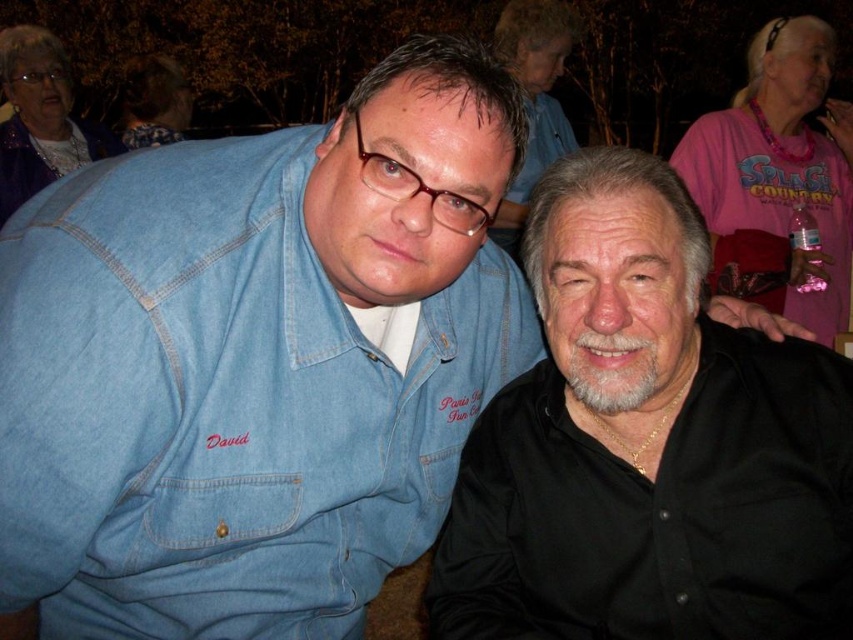
Based on the photo, how distant is matte purple jacket at upper left from matte pink shirt at upper center?

The distance of matte purple jacket at upper left from matte pink shirt at upper center is 6.37 feet.

How much distance is there between matte purple jacket at upper left and matte pink shirt at upper center?

1.94 meters

Image resolution: width=853 pixels, height=640 pixels. Identify the location of matte purple jacket at upper left. (39, 118).

Is point (827, 104) behind point (354, 323)?

Yes, it is.

Can you confirm if pink fabric shirt at upper right is taller than denim shirt at center?

Correct, pink fabric shirt at upper right is much taller as denim shirt at center.

Who is more forward, (830, 314) or (384, 337)?

Point (384, 337) is in front.

The height and width of the screenshot is (640, 853). I want to click on pink fabric shirt at upper right, so click(x=781, y=163).

Does pink fabric shirt at upper right have a smaller size compared to matte black hair at upper left?

Incorrect, pink fabric shirt at upper right is not smaller in size than matte black hair at upper left.

Which is above, pink fabric shirt at upper right or matte black hair at upper left?

matte black hair at upper left is higher up.

Locate an element on the screen. pink fabric shirt at upper right is located at coordinates (781, 163).